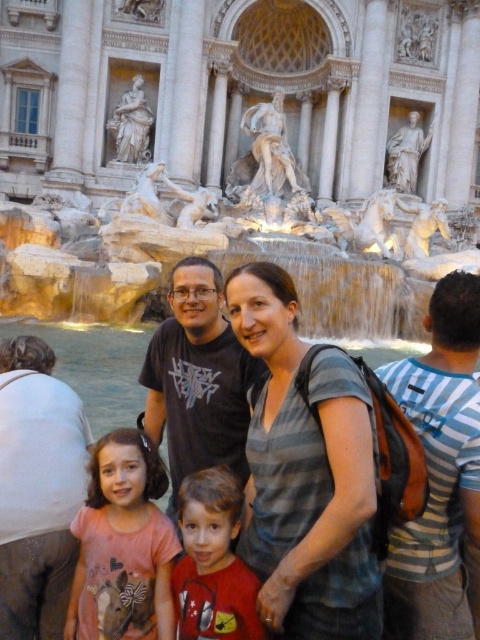
Where is `pink matte shirt at center`? pink matte shirt at center is located at coordinates (122, 545).

Is point (120, 560) positioned behind point (188, 611)?

Yes, it is.

Find the location of `pink matte shirt at center`. pink matte shirt at center is located at coordinates (122, 545).

Which is above, gray striped shirt at center or matte black t-shirt at center?

matte black t-shirt at center is higher up.

This screenshot has height=640, width=480. I want to click on gray striped shirt at center, so click(x=305, y=474).

Looking at this image, is white marble fountain at center shorter than red matte shirt at center?

Incorrect, white marble fountain at center's height does not fall short of red matte shirt at center's.

Is white marble fountain at center positioned in front of red matte shirt at center?

No.

Is point (144, 292) less distant than point (176, 604)?

No, (144, 292) is behind (176, 604).

The image size is (480, 640). Identify the location of white marble fountain at center. (216, 262).